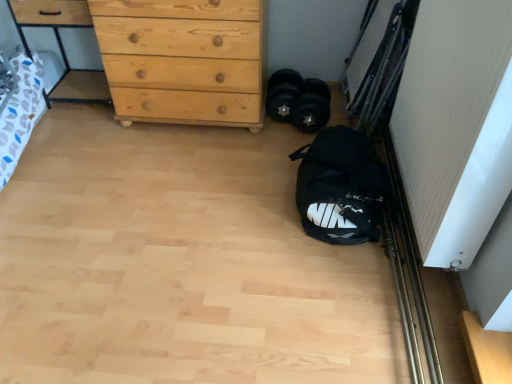
Question: Is white textured screen door at right bigger or smaller than natural wood chest of drawers at upper left?

Choices:
 (A) small
 (B) big

Answer: (A)

Question: In the image, is white textured screen door at right on the left side or the right side of natural wood chest of drawers at upper left?

Choices:
 (A) left
 (B) right

Answer: (B)

Question: Estimate the real-world distances between objects in this image. Which object is closer to the black rubber dumbbells at center?

Choices:
 (A) natural wood dresser at upper left
 (B) natural wood chest of drawers at upper left
 (C) white textured screen door at right
 (D) black fabric sack at lower right

Answer: (B)

Question: Which of these objects is positioned closest to the white textured screen door at right?

Choices:
 (A) black rubber dumbbells at center
 (B) black fabric sack at lower right
 (C) natural wood dresser at upper left
 (D) natural wood chest of drawers at upper left

Answer: (B)